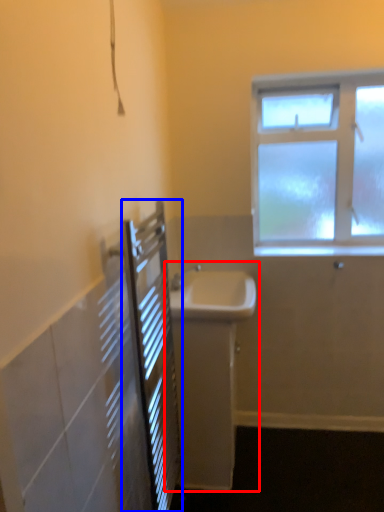
Question: Which point is closer to the camera, sink (highlighted by a red box) or screen door (highlighted by a blue box)?

Choices:
 (A) sink
 (B) screen door

Answer: (B)